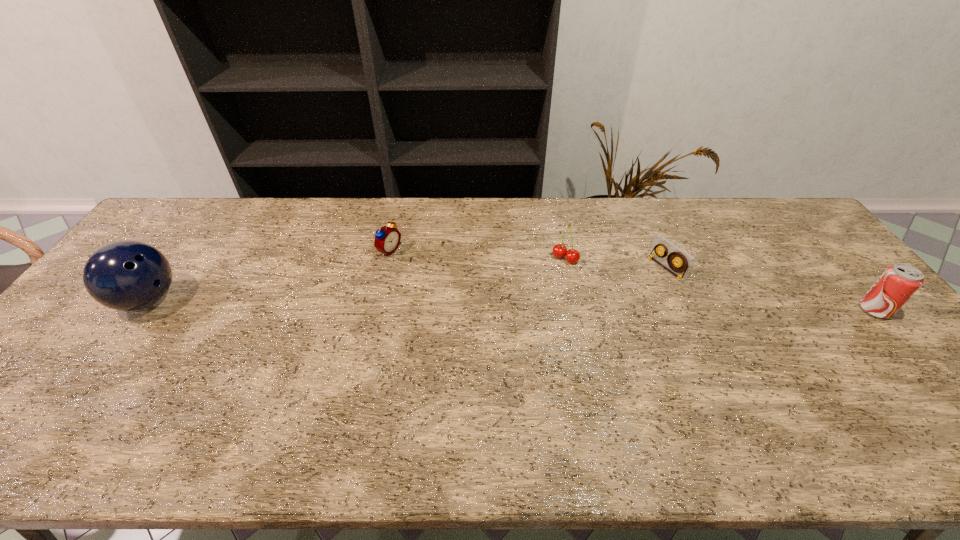
Where is `object that is at the right edge`? object that is at the right edge is located at coordinates (899, 282).

Where is `vacant position at the far edge of the desktop`? The height and width of the screenshot is (540, 960). vacant position at the far edge of the desktop is located at coordinates (318, 225).

In the image, there is a desktop. Identify the location of vacant space at the right edge. This screenshot has width=960, height=540. (900, 348).

In order to click on free location at the far right corner of the desktop in this screenshot , I will do `click(786, 238)`.

In order to click on unoccupied position between the cherry and the fourth object from left to right in this screenshot , I will do `click(615, 264)`.

This screenshot has height=540, width=960. I want to click on empty location between the cherry and the shortest object, so click(615, 264).

Where is `empty location between the tallest object and the alarm clock`? empty location between the tallest object and the alarm clock is located at coordinates (269, 275).

Find the location of a particular element. The width and height of the screenshot is (960, 540). free space between the third object from right to left and the second object from left to right is located at coordinates 477,255.

Locate an element on the screen. free point between the rightmost object and the leftmost object is located at coordinates pos(511,305).

Where is `empty space between the rightmost object and the shortest object`? empty space between the rightmost object and the shortest object is located at coordinates (770, 289).